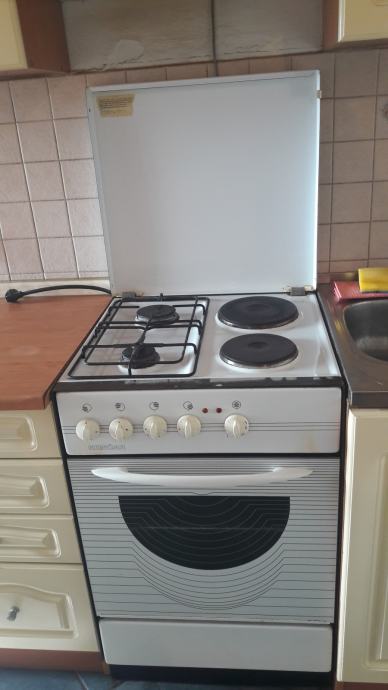
Where is `oven window`? This screenshot has width=388, height=690. oven window is located at coordinates (227, 552).